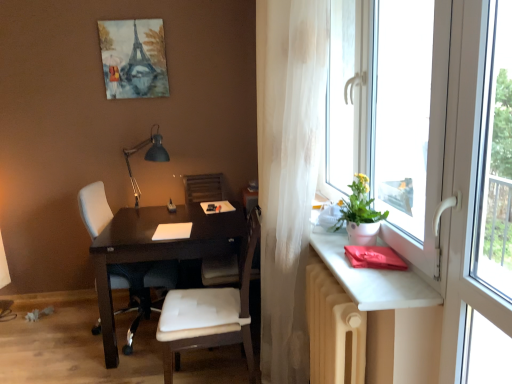
The image size is (512, 384). Describe the element at coordinates (372, 278) in the screenshot. I see `matte white table at right` at that location.

This screenshot has height=384, width=512. What do you see at coordinates (479, 197) in the screenshot? I see `white plastic screen door at right` at bounding box center [479, 197].

Where is `white matte pot at window`? The height and width of the screenshot is (384, 512). white matte pot at window is located at coordinates (360, 214).

The width and height of the screenshot is (512, 384). I want to click on white leather chair at center, which appears as the first chair when viewed from the right, so tap(209, 315).

From the picture: From the image's perspective, who appears lower, white matte pot at window or matte metal desk lamp at upper left?

From the image's view, white matte pot at window is below.

Considering the relative positions of white matte pot at window and matte metal desk lamp at upper left in the image provided, is white matte pot at window to the left of matte metal desk lamp at upper left from the viewer's perspective?

No, white matte pot at window is not to the left of matte metal desk lamp at upper left.

Is white matte pot at window wider than matte metal desk lamp at upper left?

Incorrect, the width of white matte pot at window does not surpass that of matte metal desk lamp at upper left.

The height and width of the screenshot is (384, 512). In order to click on houseplant lying below the matte metal desk lamp at upper left (from the image's perspective) in this screenshot , I will do `click(360, 214)`.

Considering the positions of objects white leather chair at center, which ranks as the 2th chair in front-to-back order, and watercolor paper painting at upper center in the image provided, who is more to the right, white leather chair at center, which ranks as the 2th chair in front-to-back order, or watercolor paper painting at upper center?

white leather chair at center, which ranks as the 2th chair in front-to-back order, is more to the right.

The image size is (512, 384). Identify the location of picture frame above the white leather chair at center, which ranks as the 2th chair in front-to-back order (from the image's perspective). (133, 58).

Is white leather chair at center, which appears as the 1th chair when viewed from the left, smaller than watercolor paper painting at upper center?

No.

Is white leather chair at center, which appears as the 1th chair when viewed from the left, far away from watercolor paper painting at upper center?

That's right, there is a large distance between white leather chair at center, which appears as the 1th chair when viewed from the left, and watercolor paper painting at upper center.

Which is closer, [176,299] or [335,323]?

Point [335,323]

Is white leather chair at center, the first chair from the front, smaller than beige radiator at lower right?

Actually, white leather chair at center, the first chair from the front, might be larger than beige radiator at lower right.

Would you say white leather chair at center, which is the second chair from back to front, contains beige radiator at lower right?

No, white leather chair at center, which is the second chair from back to front, does not contain beige radiator at lower right.

Can you confirm if watercolor paper painting at upper center is smaller than matte white table at right?

Correct, watercolor paper painting at upper center occupies less space than matte white table at right.

Is watercolor paper painting at upper center oriented towards matte white table at right?

No, watercolor paper painting at upper center is not turned towards matte white table at right.

Consider the image. Does watercolor paper painting at upper center have a lesser height compared to matte white table at right?

Incorrect, the height of watercolor paper painting at upper center does not fall short of that of matte white table at right.

In the scene shown: What's the angular difference between watercolor paper painting at upper center and matte white table at right's facing directions?

There is a 89-degree angle between the facing directions of watercolor paper painting at upper center and matte white table at right.

Does dark wood desk at center have a lesser width compared to watercolor paper painting at upper center?

In fact, dark wood desk at center might be wider than watercolor paper painting at upper center.

From the picture: How many degrees apart are the facing directions of dark wood desk at center and watercolor paper painting at upper center?

The facing directions of dark wood desk at center and watercolor paper painting at upper center are 2.26 degrees apart.

Who is more distant, dark wood desk at center or watercolor paper painting at upper center?

Positioned behind is watercolor paper painting at upper center.

From their relative heights in the image, would you say dark wood desk at center is taller or shorter than watercolor paper painting at upper center?

In the image, dark wood desk at center appears to be taller than watercolor paper painting at upper center.

Is white plastic window at right inside translucent white curtain at right?

No, white plastic window at right is not surrounded by translucent white curtain at right.

How different are the orientations of translucent white curtain at right and white plastic window at right in degrees?

There is a 1.06-degree angle between the facing directions of translucent white curtain at right and white plastic window at right.

Which is behind, translucent white curtain at right or white plastic window at right?

translucent white curtain at right is further from the camera.

Based on the photo, is translucent white curtain at right far away from matte white table at right?

translucent white curtain at right is near matte white table at right, not far away.

Is point (272, 358) positioned in front of point (349, 281)?

No, it is behind (349, 281).

Can you confirm if translucent white curtain at right is thinner than matte white table at right?

No.

Is translucent white curtain at right taller or shorter than matte white table at right?

Considering their sizes, translucent white curtain at right has more height than matte white table at right.

The height and width of the screenshot is (384, 512). I want to click on houseplant in front of the matte metal desk lamp at upper left, so click(x=360, y=214).

Which chair is the 1st one when counting from the right side of the watercolor paper painting at upper center? Please provide its 2D coordinates.

[(141, 287)]

Which object lies further to the anchor point white plastic window at right, white plastic screen door at right or dark wood desk at center?

dark wood desk at center is positioned further to the anchor white plastic window at right.

From the image, which object appears to be nearer to white leather chair at center, which ranks as the 2th chair in front-to-back order, wooden armchair at center or white plastic window at right?

wooden armchair at center lies closer to white leather chair at center, which ranks as the 2th chair in front-to-back order, than the other object.

Considering their positions, is matte metal desk lamp at upper left positioned further to white plastic window at right than beige radiator at lower right?

Among the two, matte metal desk lamp at upper left is located further to white plastic window at right.

Looking at the image, which one is located closer to watercolor paper painting at upper center, white leather chair at center, which ranks as the 2th chair in front-to-back order, or matte white table at right?

Among the two, white leather chair at center, which ranks as the 2th chair in front-to-back order, is located nearer to watercolor paper painting at upper center.

From the picture: When comparing their distances from wooden armchair at center, does matte metal desk lamp at upper left or translucent white curtain at right seem closer?

matte metal desk lamp at upper left is positioned closer to the anchor wooden armchair at center.

Estimate the real-world distances between objects in this image. Which object is further from translucent white curtain at right, beige radiator at lower right or wooden armchair at center?

The object further to translucent white curtain at right is wooden armchair at center.

Estimate the real-world distances between objects in this image. Which object is further from translucent white curtain at right, white plastic window at right or watercolor paper painting at upper center?

watercolor paper painting at upper center lies further to translucent white curtain at right than the other object.

Considering their positions, is white plastic window at right positioned further to watercolor paper painting at upper center than white plastic screen door at right?

white plastic screen door at right is positioned further to the anchor watercolor paper painting at upper center.

Where is `computer desk positioned between beige radiator at lower right and wooden armchair at center from near to far`? The width and height of the screenshot is (512, 384). computer desk positioned between beige radiator at lower right and wooden armchair at center from near to far is located at coordinates (150, 233).

In order to click on table lamp positioned between white plastic window at right and wooden armchair at center from near to far in this screenshot , I will do `click(146, 157)`.

This screenshot has height=384, width=512. In order to click on armchair between matte metal desk lamp at upper left and white leather chair at center, marked as the first chair in a back-to-front arrangement, from top to bottom in this screenshot , I will do `click(220, 271)`.

Identify the location of table between white plastic window at right and beige radiator at lower right from top to bottom. Image resolution: width=512 pixels, height=384 pixels. (372, 278).